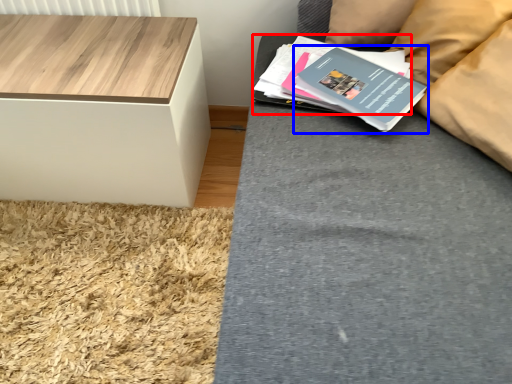
Question: Which point is further to the camera, paperback book (highlighted by a red box) or paperback book (highlighted by a blue box)?

Choices:
 (A) paperback book
 (B) paperback book

Answer: (A)